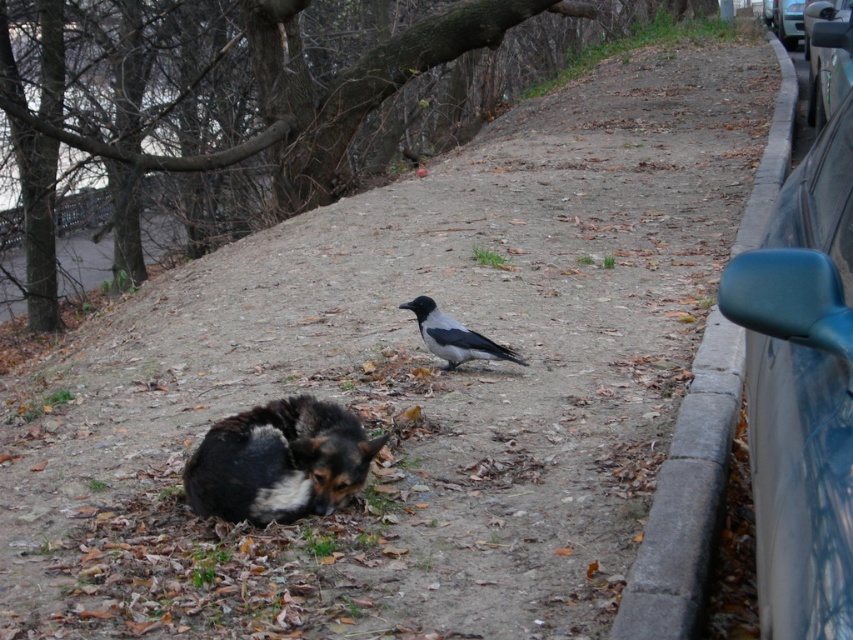
Question: Does black fur dog at lower left appear on the left side of metallic blue car at right?

Choices:
 (A) yes
 (B) no

Answer: (A)

Question: Is black fur dog at lower left positioned behind metallic blue car at right?

Choices:
 (A) no
 (B) yes

Answer: (A)

Question: Which of the following is the closest to the observer?

Choices:
 (A) (810, 109)
 (B) (849, 340)
 (C) (772, 22)

Answer: (B)

Question: Is black fur dog at lower left in front of metallic gray car at right?

Choices:
 (A) no
 (B) yes

Answer: (B)

Question: Which of the following is the closest to the observer?

Choices:
 (A) metallic blue car at right
 (B) metallic blue car mirror at right

Answer: (B)

Question: Which point is closer to the camera?

Choices:
 (A) gray concrete curb at right
 (B) metallic gray car at right
 (C) gray matte bird at center
 (D) metallic blue car at right

Answer: (A)